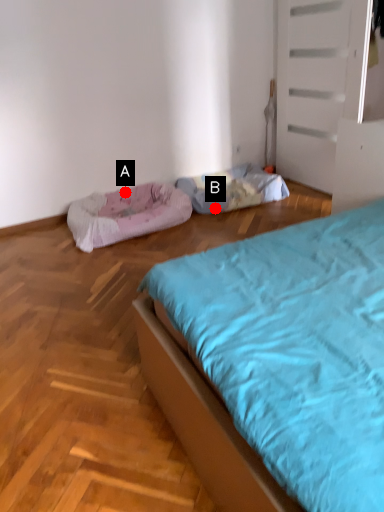
Question: Two points are circled on the image, labeled by A and B beside each circle. Among these points, which one is nearest to the camera?

Choices:
 (A) A is closer
 (B) B is closer

Answer: (B)